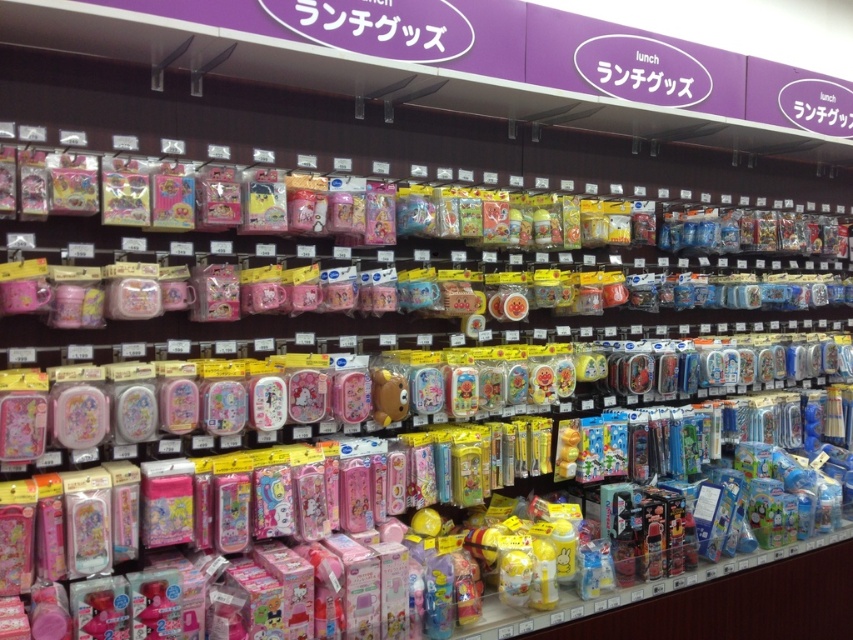
Question: Is matte brown bear at center further to the viewer compared to translucent plastic bear at center?

Choices:
 (A) yes
 (B) no

Answer: (B)

Question: Is matte brown bear at center to the right of translucent plastic bear at center from the viewer's perspective?

Choices:
 (A) no
 (B) yes

Answer: (A)

Question: Is matte brown bear at center in front of translucent plastic bear at center?

Choices:
 (A) yes
 (B) no

Answer: (A)

Question: Which of the following is the farthest from the observer?

Choices:
 (A) [x=474, y=372]
 (B) [x=386, y=384]

Answer: (A)